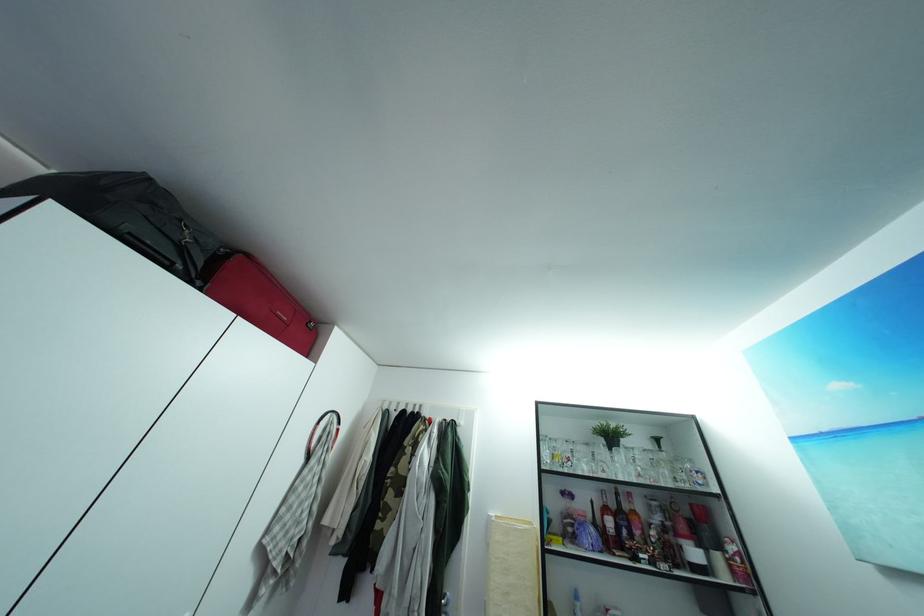
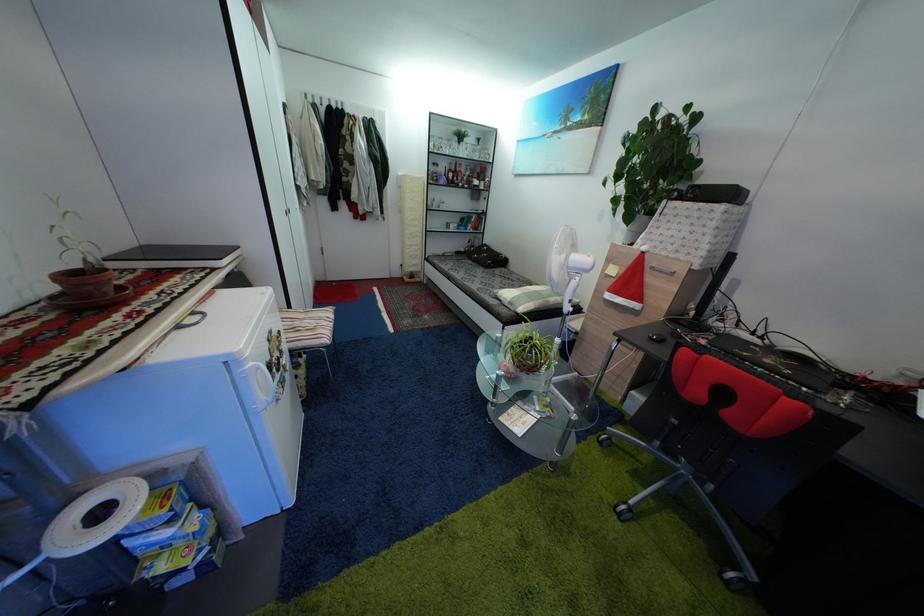
Find the pixel in the second image that matches point (580, 504) in the first image.

(445, 172)